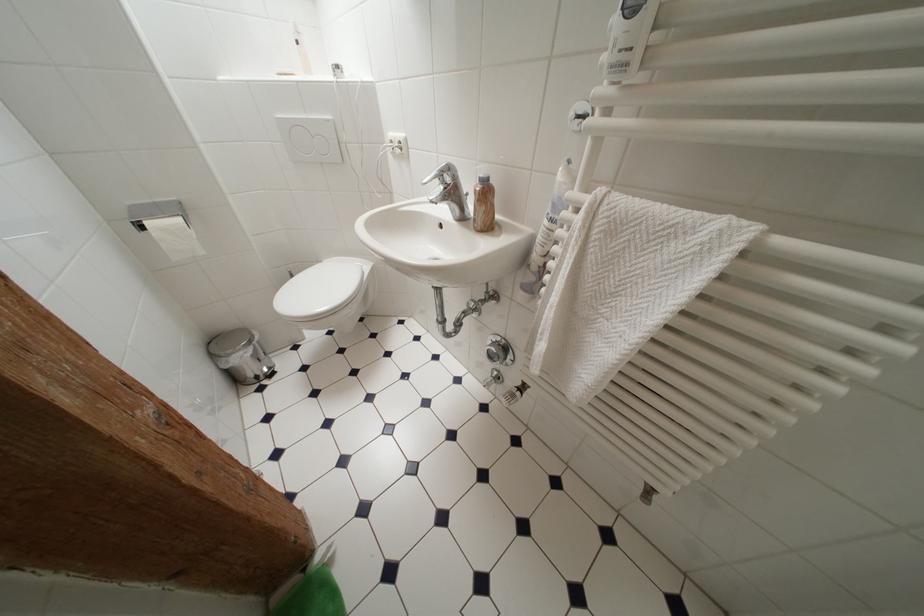
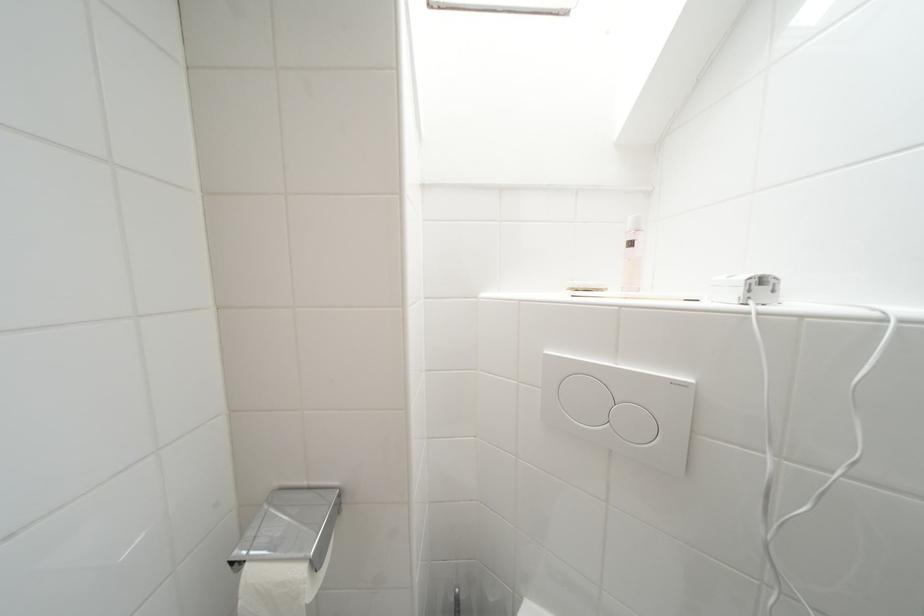
Locate, in the second image, the point that corresponds to point (344, 70) in the first image.

(769, 283)